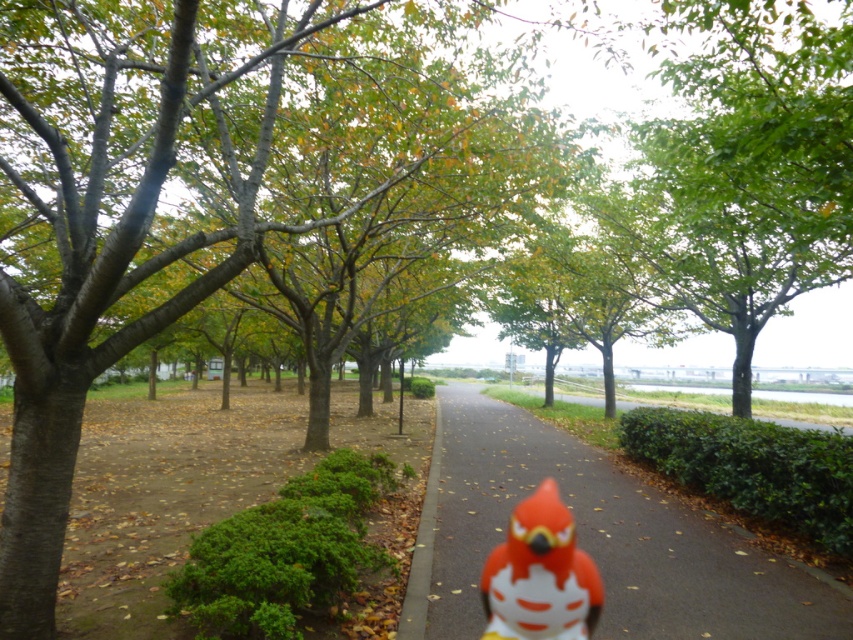
You are a photographer setting up a tripod in the park. You want to capture the matte orange bird at center in the foreground while including the smooth asphalt path at center leading into the background. Since the path is taller than the bird, will the bird still be visible in the frame if you focus on the path?

Yes, the matte orange bird at center will still be visible in the frame because even though the smooth asphalt path at center is taller, the bird is positioned at the center and the path curves gently, allowing both elements to coexist in the composition.

You are a photographer setting up a tripod in the park. You want to capture both the smooth asphalt path at center and the matte orange bird at center in your shot. Based on their positions, which object should appear lower in the photo?

The smooth asphalt path at center is positioned below the matte orange bird at center in the image, so it will naturally appear lower in the photo.